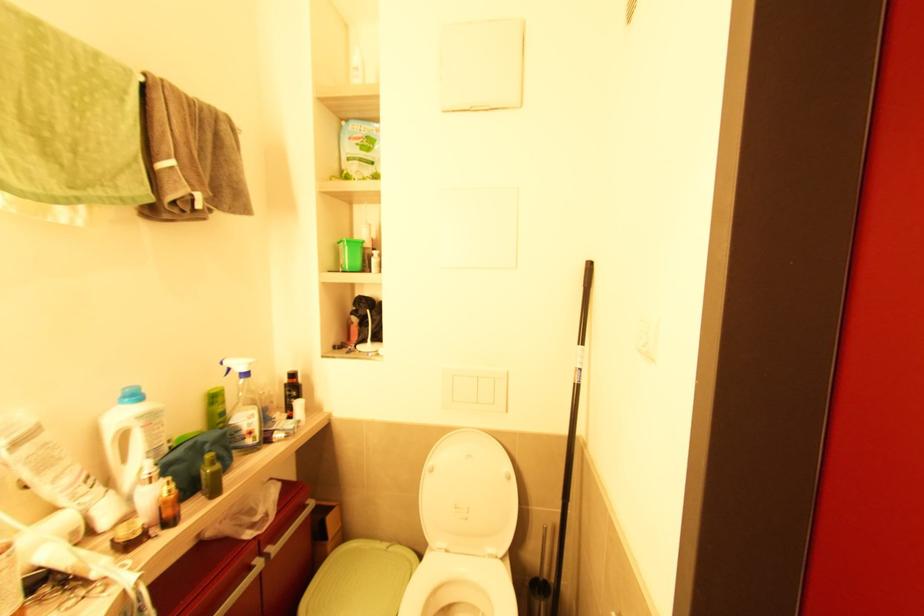
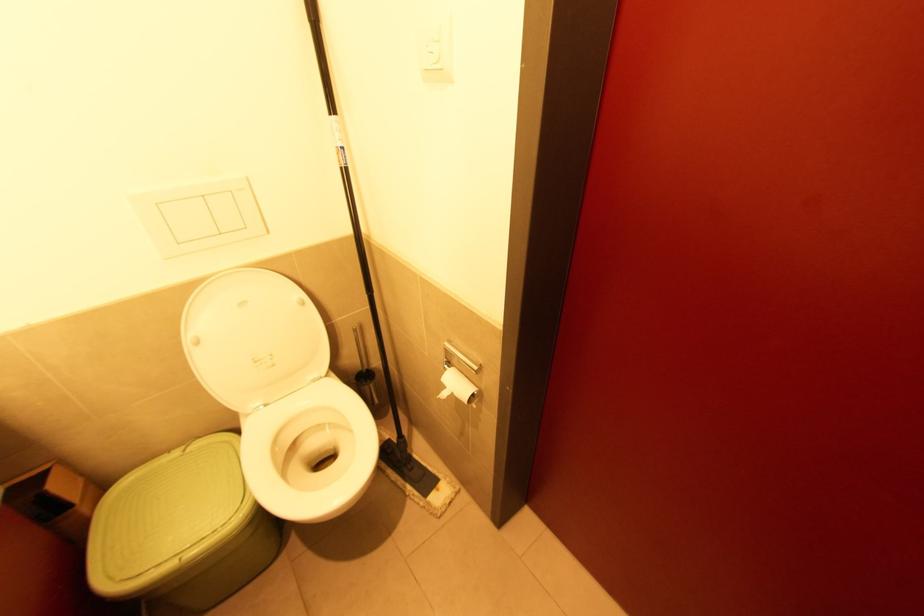
Locate, in the second image, the point that corresponds to pixel 578 387 in the first image.

(347, 172)